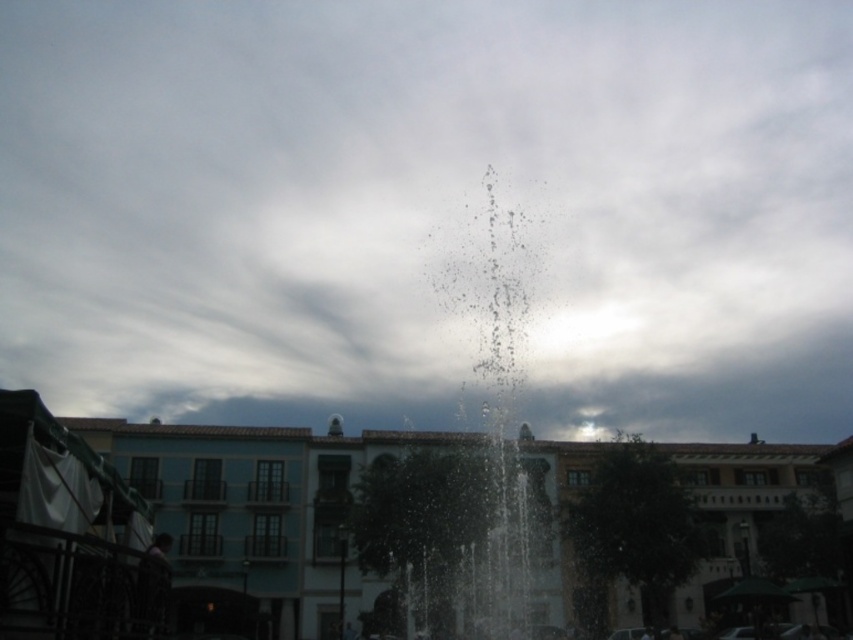
Who is more distant from viewer, (183, 332) or (322, 577)?

Point (183, 332)

Does point (625, 176) come farther from viewer compared to point (721, 524)?

Yes, point (625, 176) is farther from viewer.

Image resolution: width=853 pixels, height=640 pixels. In order to click on white fluffy cloud at center in this screenshot , I will do `click(428, 208)`.

I want to click on white fluffy cloud at center, so click(x=428, y=208).

Is white glossy fountain at center above clear water at center?

No, white glossy fountain at center is not above clear water at center.

Does point (207, 589) come closer to viewer compared to point (494, 276)?

Yes, it is in front of point (494, 276).

Which is in front, point (164, 518) or point (479, 257)?

Point (164, 518)

Locate an element on the screen. This screenshot has width=853, height=640. white glossy fountain at center is located at coordinates (228, 508).

The width and height of the screenshot is (853, 640). What do you see at coordinates (428, 208) in the screenshot?
I see `white fluffy cloud at center` at bounding box center [428, 208].

Does white fluffy cloud at center have a lesser height compared to clear water at center?

No, white fluffy cloud at center is not shorter than clear water at center.

This screenshot has height=640, width=853. Find the location of `white fluffy cloud at center`. white fluffy cloud at center is located at coordinates (428, 208).

Find the location of a particular element. The width and height of the screenshot is (853, 640). white fluffy cloud at center is located at coordinates (428, 208).